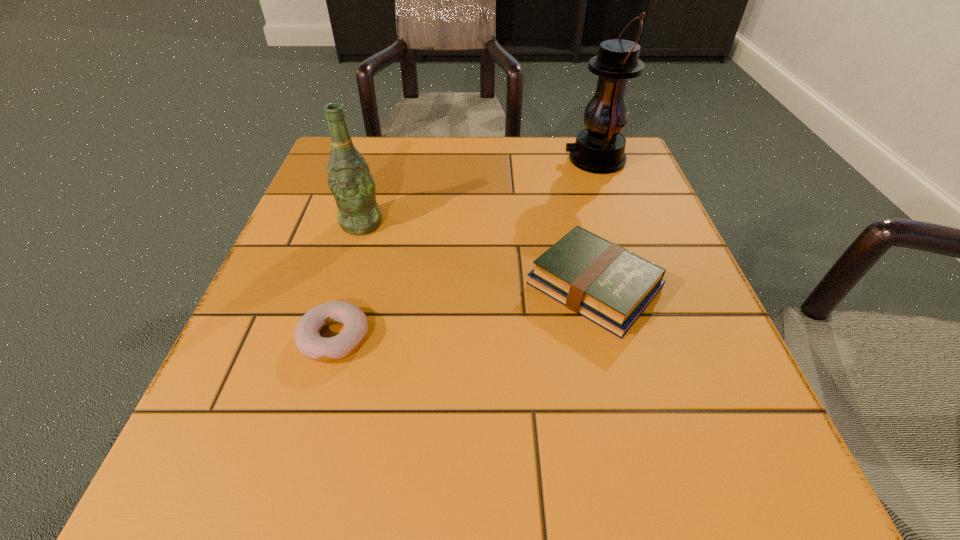
Where is `vacant region at the left edge of the desktop`? The width and height of the screenshot is (960, 540). vacant region at the left edge of the desktop is located at coordinates (273, 307).

I want to click on vacant space at the right edge of the desktop, so coord(651,207).

At what (x,y) coordinates should I click in order to perform the action: click on vacant space at the near left corner of the desktop. Please return your answer as a coordinate pair (x, y). The image size is (960, 540). Looking at the image, I should click on (221, 515).

In the image, there is a desktop. At what (x,y) coordinates should I click in order to perform the action: click on free region at the near right corner. Please return your answer as a coordinate pair (x, y). The height and width of the screenshot is (540, 960). Looking at the image, I should click on (794, 486).

Locate an element on the screen. The height and width of the screenshot is (540, 960). vacant point located between the beer bottle and the tallest object is located at coordinates (478, 192).

Locate an element on the screen. The height and width of the screenshot is (540, 960). vacant region between the second farthest object and the shortest object is located at coordinates (348, 281).

Find the location of a particular element. This screenshot has width=960, height=540. unoccupied position between the beer bottle and the book is located at coordinates (478, 255).

I want to click on free space between the book and the third nearest object, so click(478, 255).

At what (x,y) coordinates should I click in order to perform the action: click on free spot between the lantern and the second shortest object. Please return your answer as a coordinate pair (x, y). Image resolution: width=960 pixels, height=540 pixels. Looking at the image, I should click on tap(594, 223).

Locate an element on the screen. This screenshot has width=960, height=540. vacant space that's between the tallest object and the beer bottle is located at coordinates (478, 192).